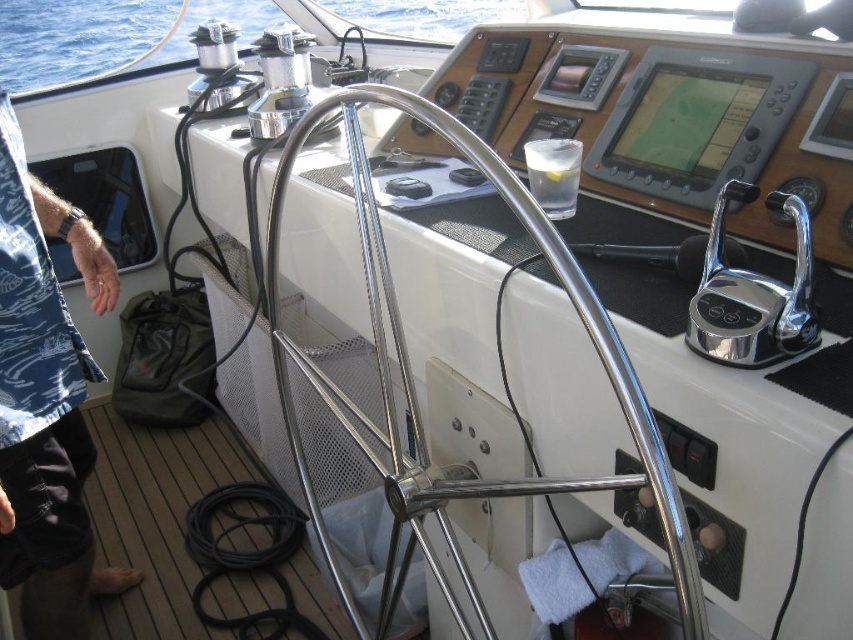
Question: Is blue printed fabric at left smaller than blue water at upper left?

Choices:
 (A) no
 (B) yes

Answer: (B)

Question: Can you confirm if blue printed fabric at left is wider than blue water at upper left?

Choices:
 (A) no
 (B) yes

Answer: (A)

Question: Which of the following is the closest to the observer?

Choices:
 (A) (132, 3)
 (B) (15, 284)

Answer: (B)

Question: Is blue printed fabric at left wider than blue water at upper left?

Choices:
 (A) no
 (B) yes

Answer: (A)

Question: Which point is farther to the camera?

Choices:
 (A) blue printed fabric at left
 (B) blue water at upper left

Answer: (B)